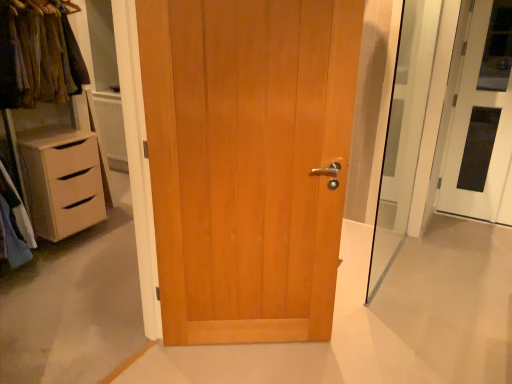
Where is `vacant location below transparent glass screen door at right (from a real-world perspective)`? The height and width of the screenshot is (384, 512). vacant location below transparent glass screen door at right (from a real-world perspective) is located at coordinates (393, 261).